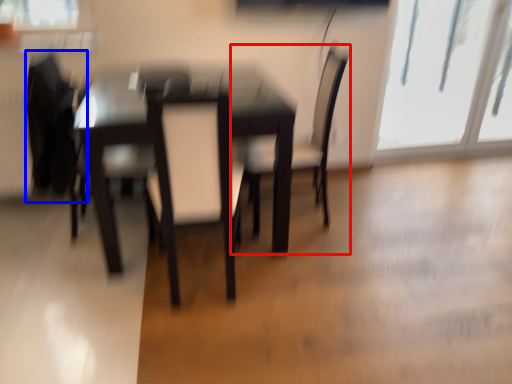
Question: Which of the following is the farthest to the observer, chair (highlighted by a red box) or swivel chair (highlighted by a blue box)?

Choices:
 (A) chair
 (B) swivel chair

Answer: (A)